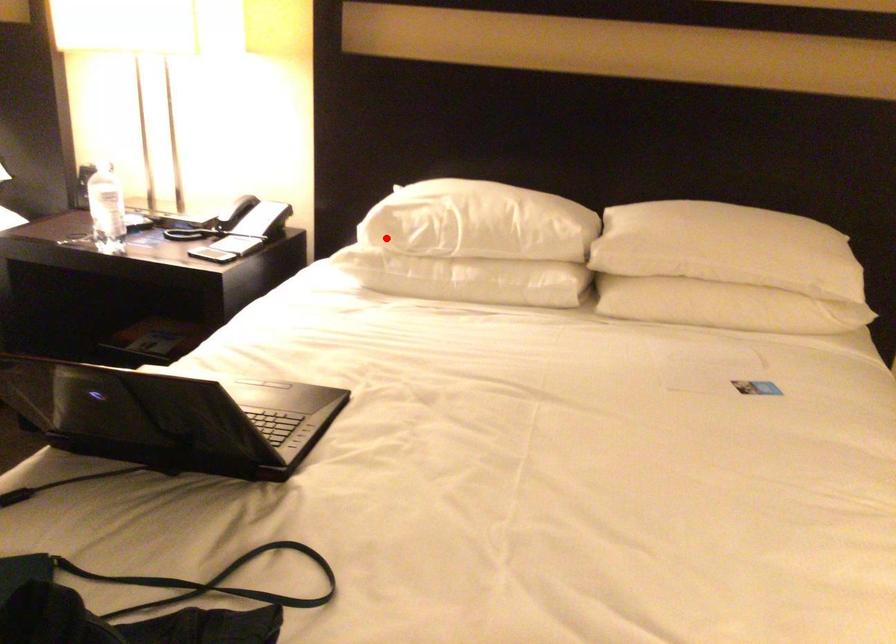
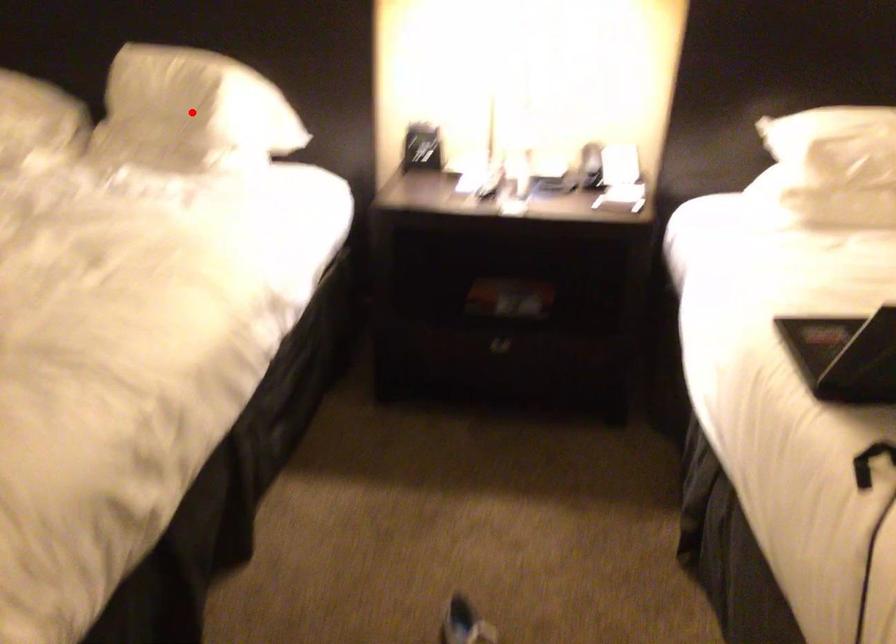
I am providing you with two images of the same scene from different viewpoints. A red point is marked on the first image and another point is marked on the second image. Is the marked point in image1 the same physical position as the marked point in image2?

No